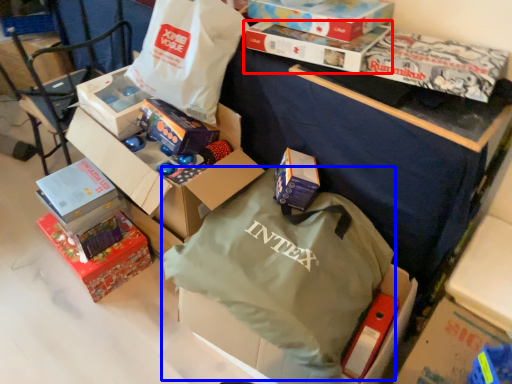
Question: Which object is further to the camera taking this photo, box (highlighted by a red box) or bag (highlighted by a blue box)?

Choices:
 (A) box
 (B) bag

Answer: (A)